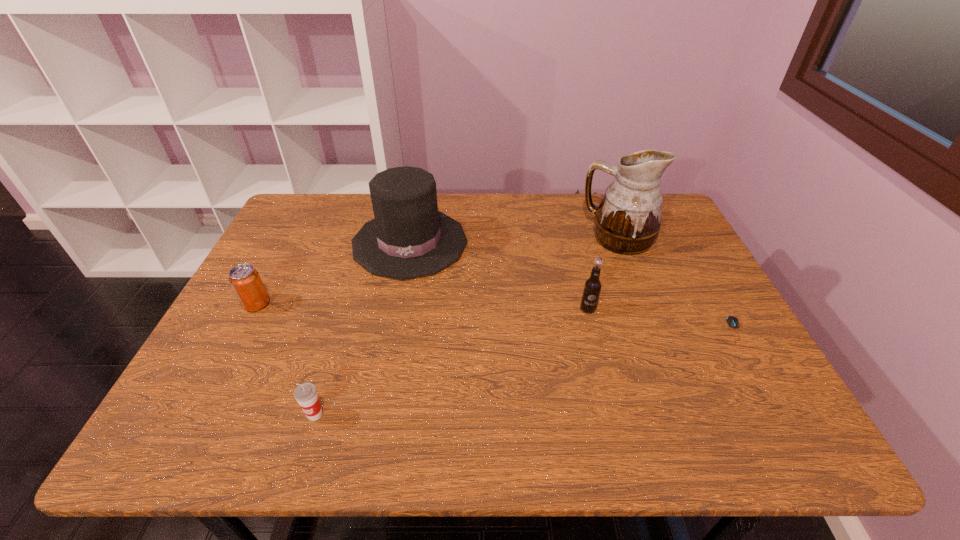
Where is `pitcher present at the right edge`? The image size is (960, 540). pitcher present at the right edge is located at coordinates (628, 218).

Where is `mouse present at the right edge`? The width and height of the screenshot is (960, 540). mouse present at the right edge is located at coordinates (732, 321).

The image size is (960, 540). In order to click on object that is positioned at the far right corner in this screenshot , I will do `click(628, 218)`.

Identify the location of free space at the far edge of the desktop. (487, 197).

In the image, there is a desktop. Where is `vacant space at the near edge`? This screenshot has height=540, width=960. vacant space at the near edge is located at coordinates pyautogui.click(x=410, y=435).

In the image, there is a desktop. Find the location of `blank space at the left edge`. blank space at the left edge is located at coordinates (234, 391).

This screenshot has height=540, width=960. I want to click on vacant space at the right edge of the desktop, so click(705, 360).

The width and height of the screenshot is (960, 540). What are the coordinates of `vacant region at the far left corner` in the screenshot? It's located at (309, 221).

Find the location of a particular element. vacant region at the near left corner of the desktop is located at coordinates (x=155, y=447).

I want to click on vacant area between the second nearest object and the tallest object, so click(x=677, y=285).